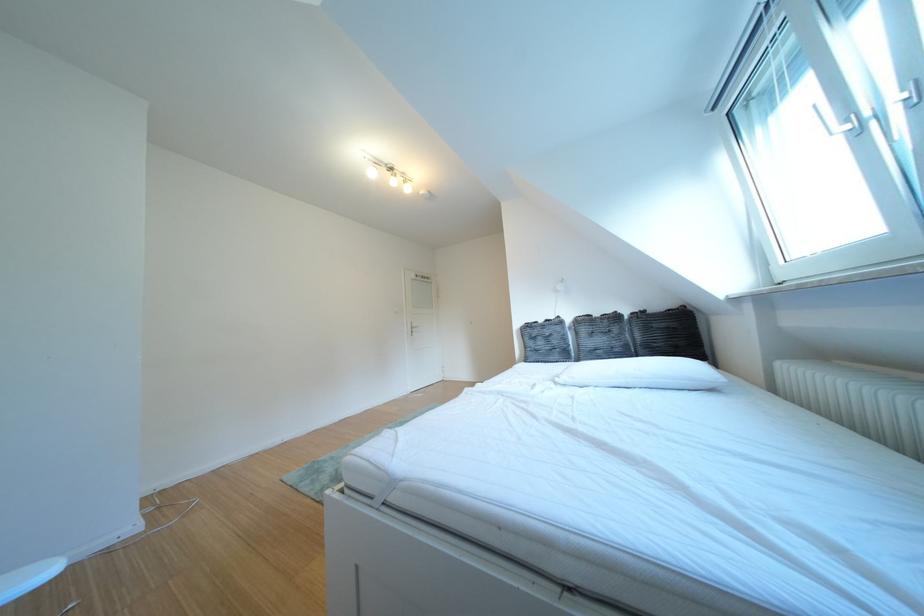
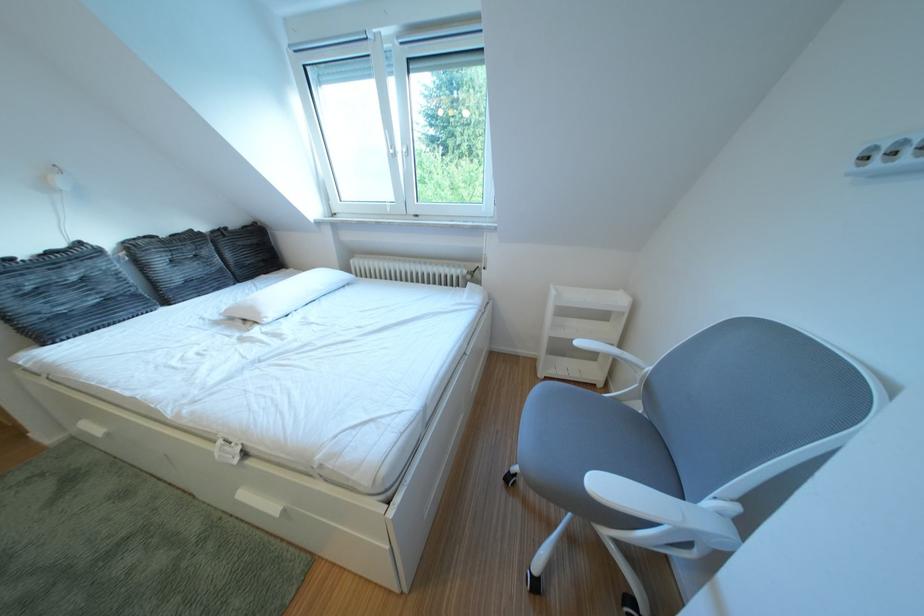
The point at [610,320] is marked in the first image. Where is the corresponding point in the second image?

(176, 240)